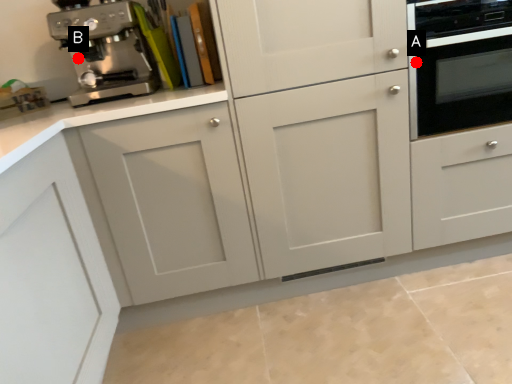
Question: Two points are circled on the image, labeled by A and B beside each circle. Which point is farther from the camera taking this photo?

Choices:
 (A) A is further
 (B) B is further

Answer: (B)